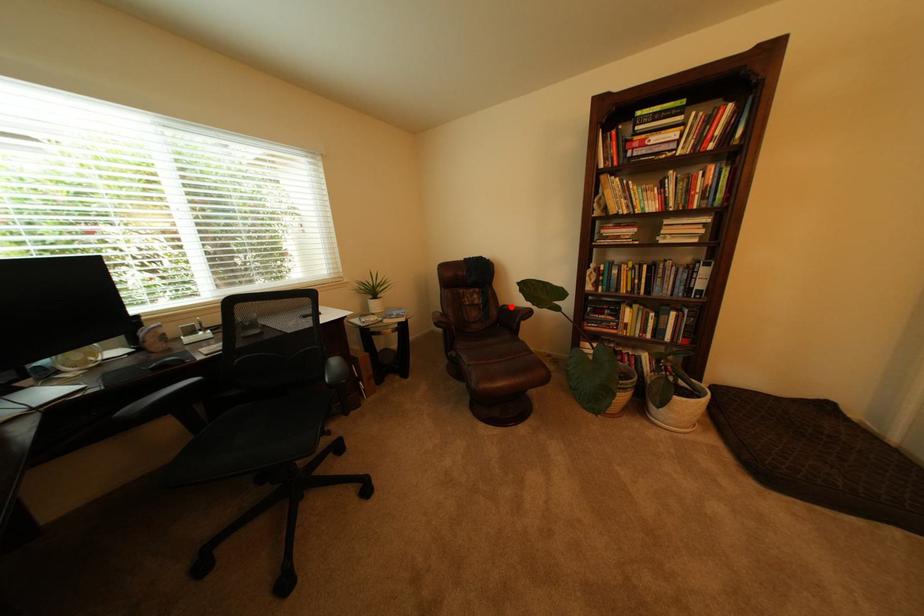
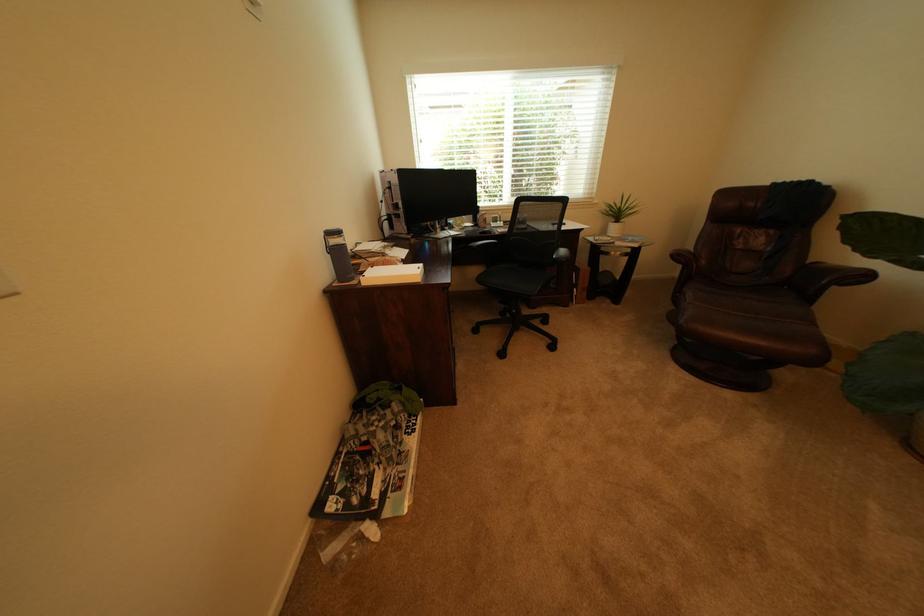
The point at the highlighted location is marked in the first image. Where is the corresponding point in the second image?

(821, 262)